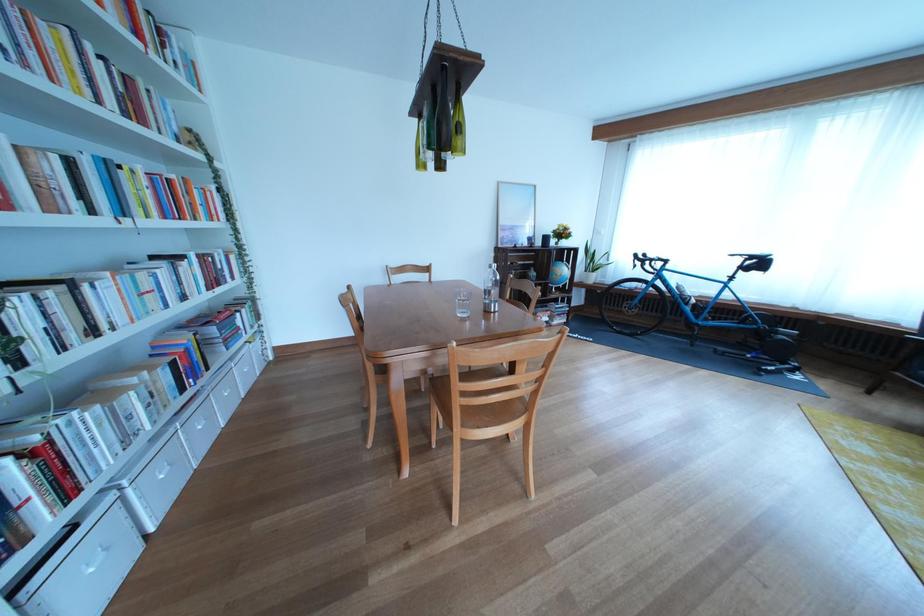
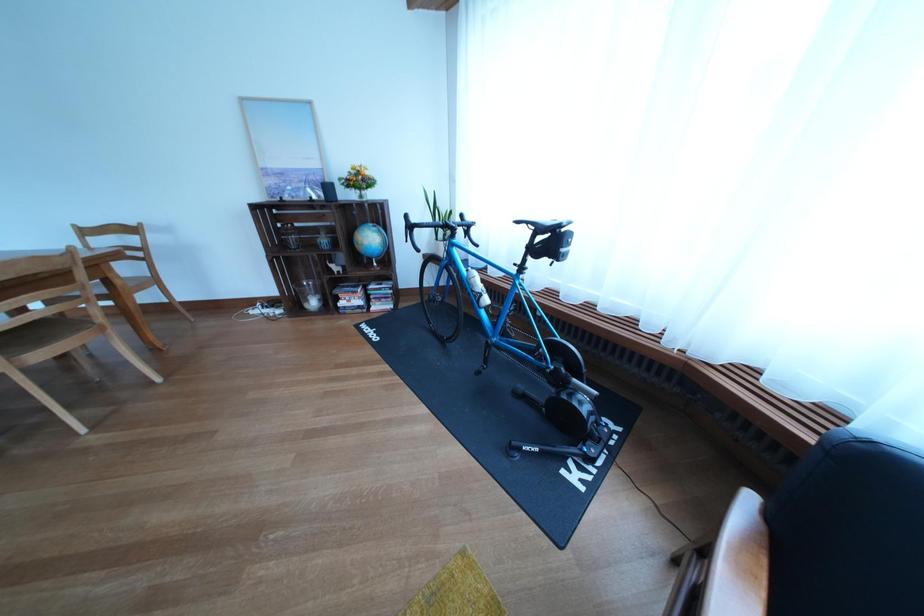
Locate, in the second image, the point that corresponds to (x=679, y=292) in the first image.

(470, 277)